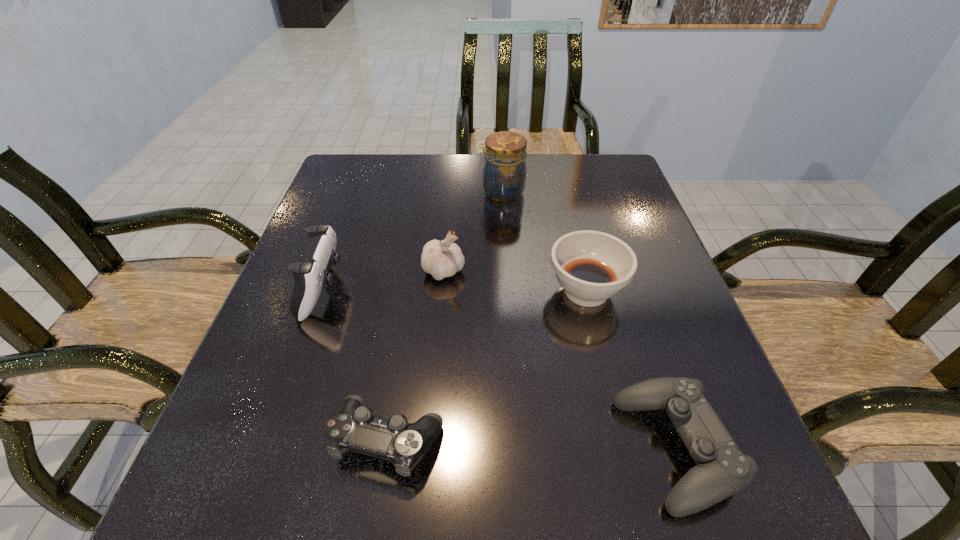
Identify the location of free spot between the leftmost control and the rightmost control. (499, 369).

Locate an element on the screen. The height and width of the screenshot is (540, 960). vacant region between the rightmost control and the farthest object is located at coordinates (588, 321).

The image size is (960, 540). I want to click on free spot between the tallest object and the garlic, so click(472, 232).

Find the location of a particular element. unoccupied area between the garlic and the soup bowl is located at coordinates (515, 281).

Find the location of `vacant space in between the leftmost control and the garlic`. vacant space in between the leftmost control and the garlic is located at coordinates (384, 280).

I want to click on vacant area that lies between the second control from left to right and the rightmost control, so click(532, 444).

This screenshot has height=540, width=960. Identify the location of free space that is in between the second control from left to right and the fourth tallest object. (488, 365).

The width and height of the screenshot is (960, 540). I want to click on the third closest object to the rightmost control, so click(x=443, y=259).

Image resolution: width=960 pixels, height=540 pixels. I want to click on the third closest object to the rightmost control, so click(443, 259).

Select which control is the third closest to the garlic. Please provide its 2D coordinates. Your answer should be formatted as a tuple, i.e. [(x, y)], where the tuple contains the x and y coordinates of a point satisfying the conditions above.

[(722, 470)]